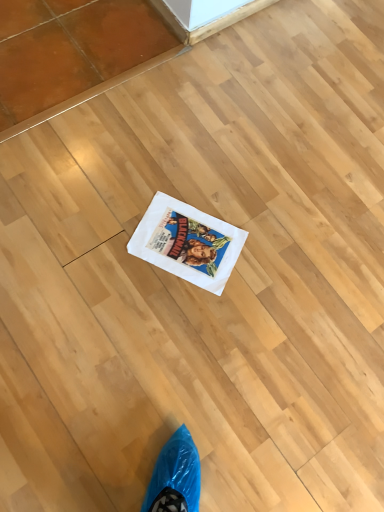
You are a GUI agent. You are given a task and a screenshot of the screen. Output one action in this format:
    pyautogui.click(x=<x>, y=<y>)
    Task: Click on the vacant area that is in front of white paper comic book at center
    The image size is (384, 512).
    Given the screenshot: What is the action you would take?
    click(x=168, y=316)